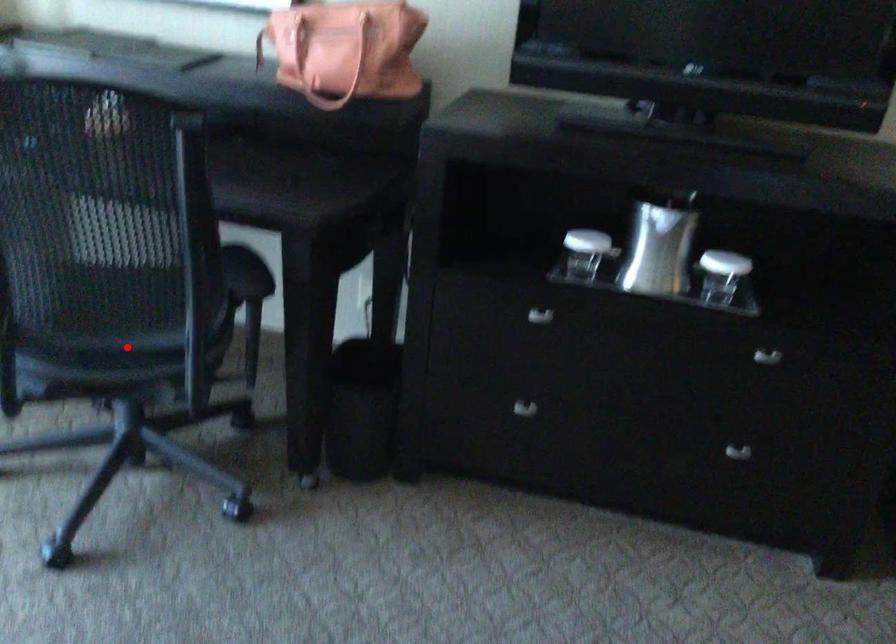
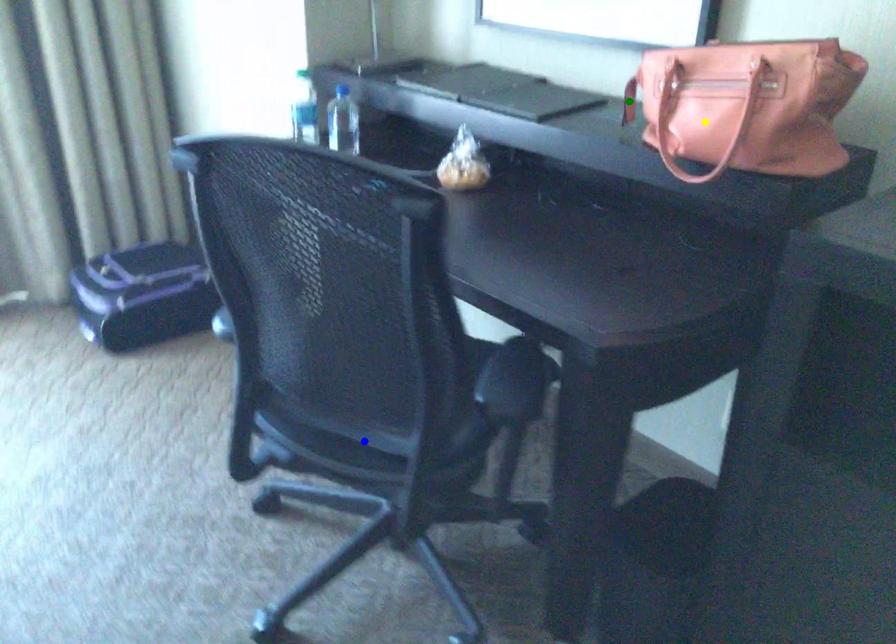
Question: I am providing you with two images of the same scene from different viewpoints. A red point is marked on the first image. You are given multiple points on the second image. Can you choose the point in image 2 that corresponds to the point in image 1?

Choices:
 (A) yellow point
 (B) green point
 (C) blue point

Answer: (C)